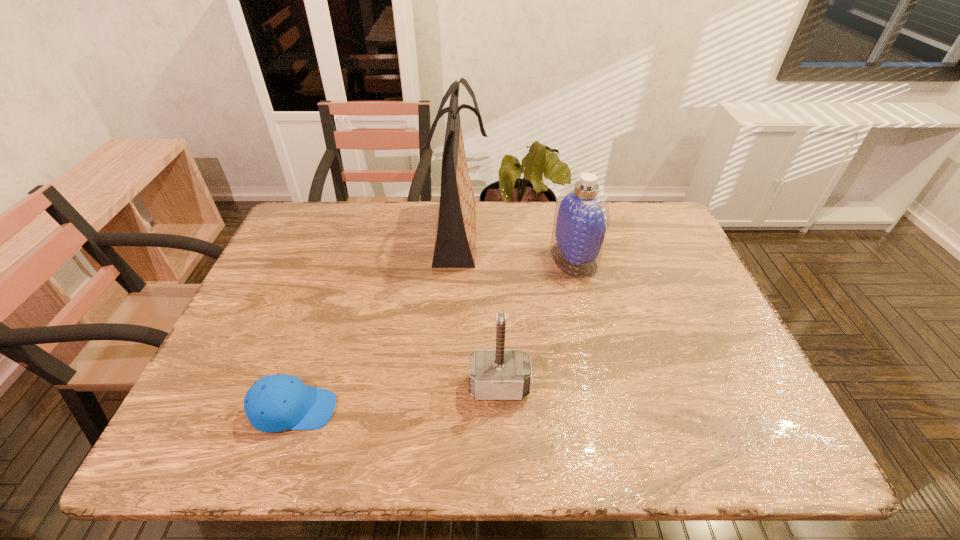
Where is `cleansing agent positioned at the far edge`? This screenshot has height=540, width=960. cleansing agent positioned at the far edge is located at coordinates (582, 216).

Find the location of `object present at the near edge`. object present at the near edge is located at coordinates (274, 403).

Where is `object situated at the left edge`? object situated at the left edge is located at coordinates (274, 403).

Where is `object that is positioned at the near left corner`? object that is positioned at the near left corner is located at coordinates (274, 403).

I want to click on vacant space at the far edge of the desktop, so click(x=492, y=240).

Identify the location of blank space at the near edge. This screenshot has height=540, width=960. (413, 456).

This screenshot has width=960, height=540. In the image, there is a desktop. Identify the location of vacant space at the left edge. (304, 260).

Image resolution: width=960 pixels, height=540 pixels. Find the location of `blank space at the right edge of the desktop`. blank space at the right edge of the desktop is located at coordinates (734, 352).

Locate an element on the screen. This screenshot has width=960, height=540. vacant area between the leftmost object and the hammer is located at coordinates (396, 398).

Locate an element on the screen. This screenshot has width=960, height=540. vacant point located between the cap and the cleansing agent is located at coordinates (434, 334).